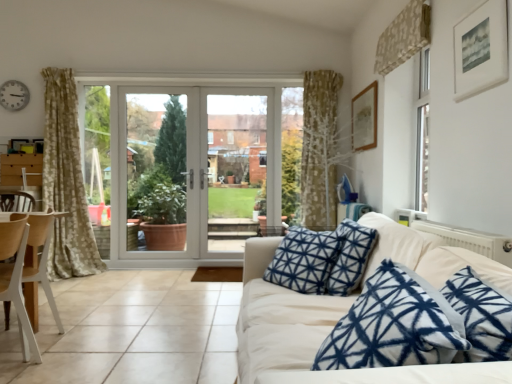
Image resolution: width=512 pixels, height=384 pixels. I want to click on free space to the right of white wood chair at lower left, so click(x=55, y=369).